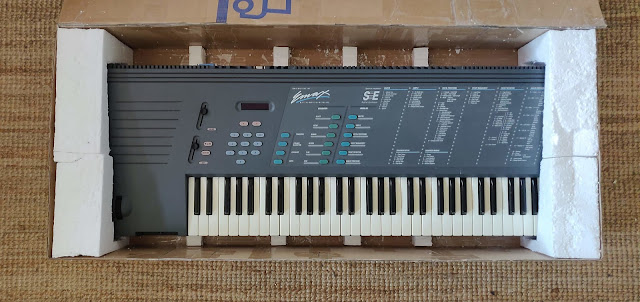
Where is `box`? box is located at coordinates [477, 29].